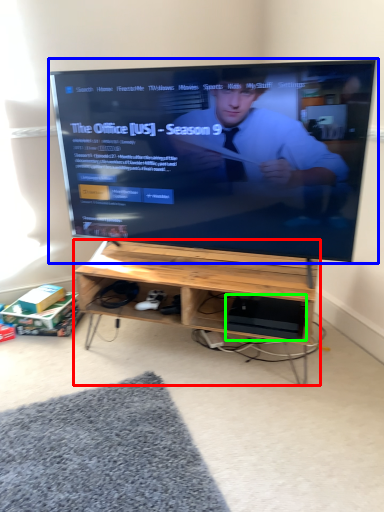
Question: Considering the real-world distances, which object is farthest from desk (highlighted by a red box)? television (highlighted by a blue box) or computer (highlighted by a green box)?

Choices:
 (A) television
 (B) computer

Answer: (A)